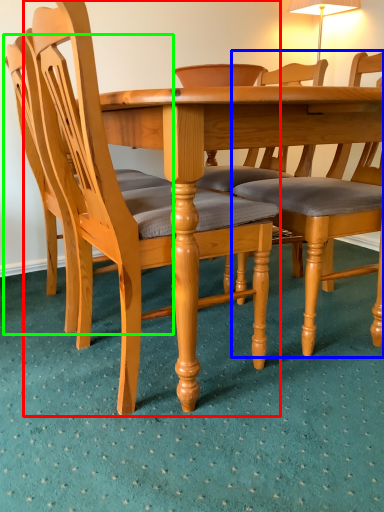
Question: Which object is positioned farthest from chair (highlighted by a red box)? Select from chair (highlighted by a blue box) and chair (highlighted by a green box).

Choices:
 (A) chair
 (B) chair

Answer: (A)